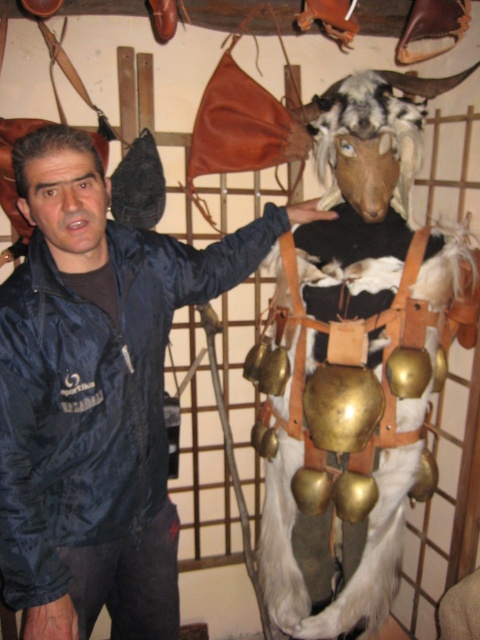
Question: Which object appears closest to the camera in this image?

Choices:
 (A) white fur animal at center
 (B) matte black jacket at center

Answer: (B)

Question: Does matte black jacket at center appear on the right side of white fur animal at center?

Choices:
 (A) no
 (B) yes

Answer: (A)

Question: Is matte black jacket at center smaller than white fur animal at center?

Choices:
 (A) yes
 (B) no

Answer: (B)

Question: Does matte black jacket at center appear on the right side of white fur animal at center?

Choices:
 (A) yes
 (B) no

Answer: (B)